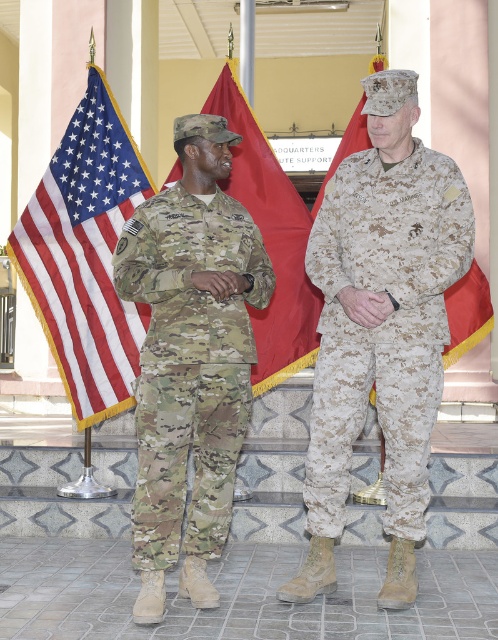
Question: From the image, what is the correct spatial relationship of digital camouflage uniform at center in relation to red fabric flag at right?

Choices:
 (A) below
 (B) above

Answer: (A)

Question: Is digital camouflage uniform at center to the right of matte fabric flag at left from the viewer's perspective?

Choices:
 (A) no
 (B) yes

Answer: (B)

Question: Is digital camouflage uniform at center smaller than red fabric flag at right?

Choices:
 (A) yes
 (B) no

Answer: (B)

Question: Considering the real-world distances, which object is farthest from the multicam uniform at left?

Choices:
 (A) matte fabric flag at left
 (B) red fabric flag at right
 (C) red fabric flag at upper center
 (D) red fabric flag at center

Answer: (A)

Question: Which is farther from the multicam uniform at left?

Choices:
 (A) matte fabric flag at left
 (B) red fabric flag at upper center

Answer: (A)

Question: Which object is positioned farthest from the red fabric flag at right?

Choices:
 (A) digital camouflage uniform at center
 (B) multicam uniform at left

Answer: (B)